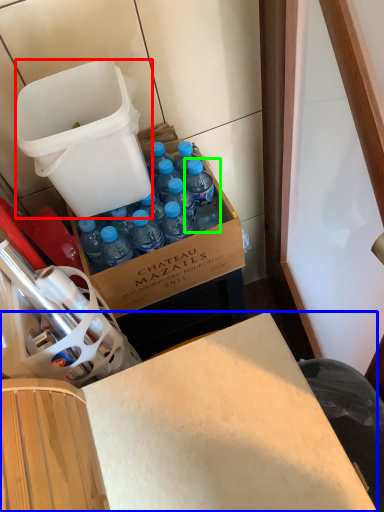
Question: Which is farther away from trash bin/can (highlighted by a red box)? desk (highlighted by a blue box) or bottle (highlighted by a green box)?

Choices:
 (A) desk
 (B) bottle

Answer: (A)